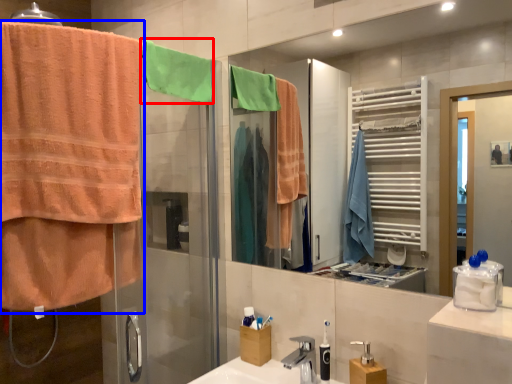
Question: Which point is closer to the camera, beach towel (highlighted by a red box) or towel (highlighted by a blue box)?

Choices:
 (A) beach towel
 (B) towel

Answer: (B)